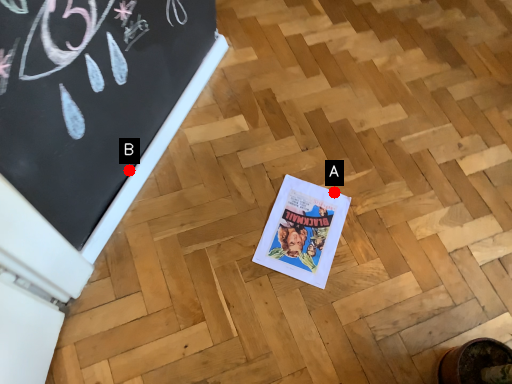
Question: Two points are circled on the image, labeled by A and B beside each circle. Among these points, which one is farthest from the camera?

Choices:
 (A) A is further
 (B) B is further

Answer: (A)